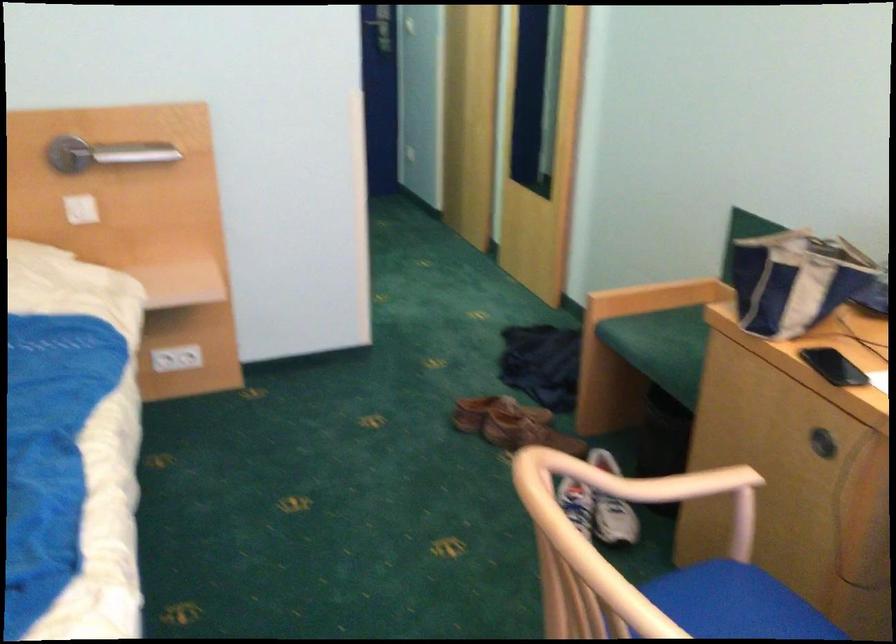
Which object does [794,279] point to?

It corresponds to the blue striped bag in the image.